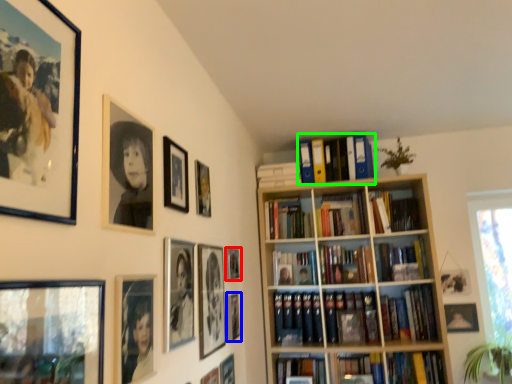
Question: Which is farther away from picture frame (highlighted by a red box)? picture frame (highlighted by a blue box) or book (highlighted by a green box)?

Choices:
 (A) picture frame
 (B) book

Answer: (B)